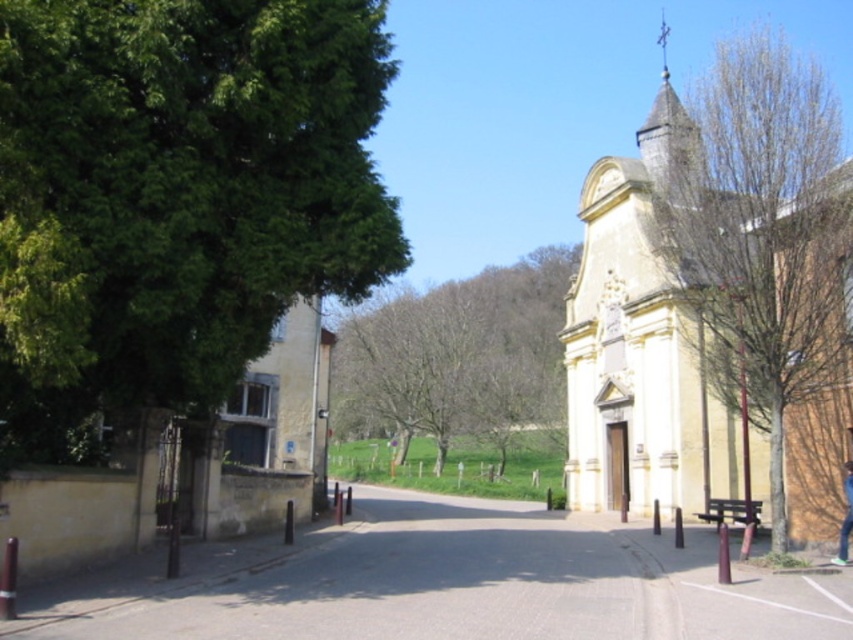
Is point (61, 6) positioned behind point (846, 484)?

No, it is in front of (846, 484).

Is green leafy tree at left further to the viewer compared to blue jeans at lower right?

That is False.

Locate an element on the screen. green leafy tree at left is located at coordinates (177, 193).

The image size is (853, 640). I want to click on yellow stone church at right, so click(706, 284).

This screenshot has width=853, height=640. Describe the element at coordinates (706, 284) in the screenshot. I see `yellow stone church at right` at that location.

What are the coordinates of `yellow stone church at right` in the screenshot? It's located at (706, 284).

Describe the element at coordinates (706, 284) in the screenshot. I see `yellow stone church at right` at that location.

How much distance is there between yellow stone church at right and bare wood tree at center?

yellow stone church at right is 22.30 meters away from bare wood tree at center.

You are a GUI agent. You are given a task and a screenshot of the screen. Output one action in this format:
    pyautogui.click(x=<x>, y=<y>)
    Task: Click on the yellow stone church at right
    
    Given the screenshot: What is the action you would take?
    pyautogui.click(x=706, y=284)

This screenshot has height=640, width=853. In order to click on yellow stone church at right in this screenshot , I will do `click(706, 284)`.